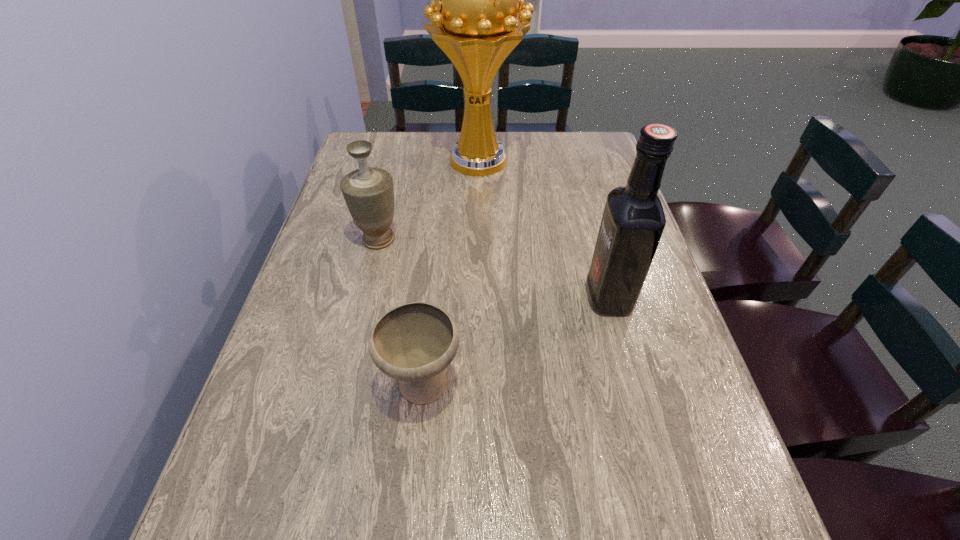
This screenshot has height=540, width=960. Find the location of `object that is the third closest one to the tallest object`. object that is the third closest one to the tallest object is located at coordinates (414, 343).

Identify which object is located as the third nearest to the tallest object. Please provide its 2D coordinates. Your answer should be formatted as a tuple, i.e. [(x, y)], where the tuple contains the x and y coordinates of a point satisfying the conditions above.

[(414, 343)]

Where is `free spot that satisfies the following two spatial constraints: 1. on the front side of the third tallest object; 2. on the left side of the nearest object`? free spot that satisfies the following two spatial constraints: 1. on the front side of the third tallest object; 2. on the left side of the nearest object is located at coordinates (344, 385).